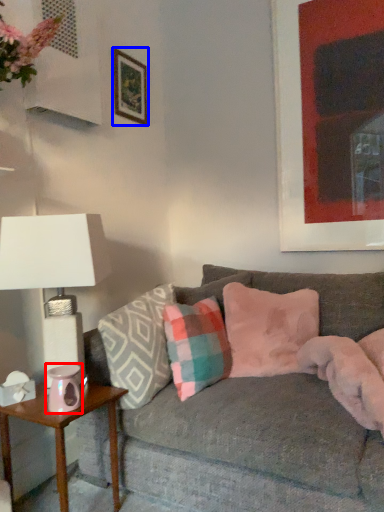
Question: Which object is further to the camera taking this photo, candle holder (highlighted by a red box) or picture frame (highlighted by a blue box)?

Choices:
 (A) candle holder
 (B) picture frame

Answer: (B)